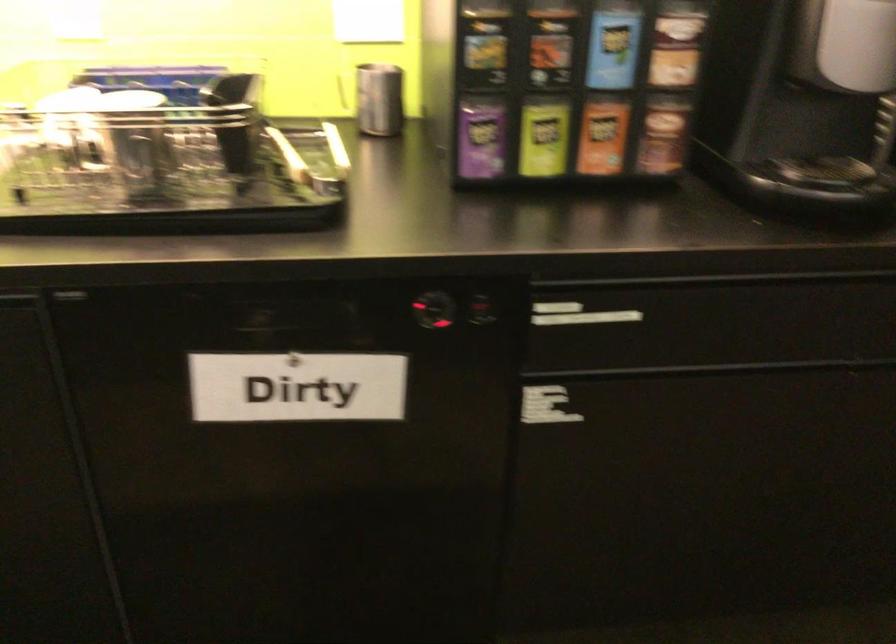
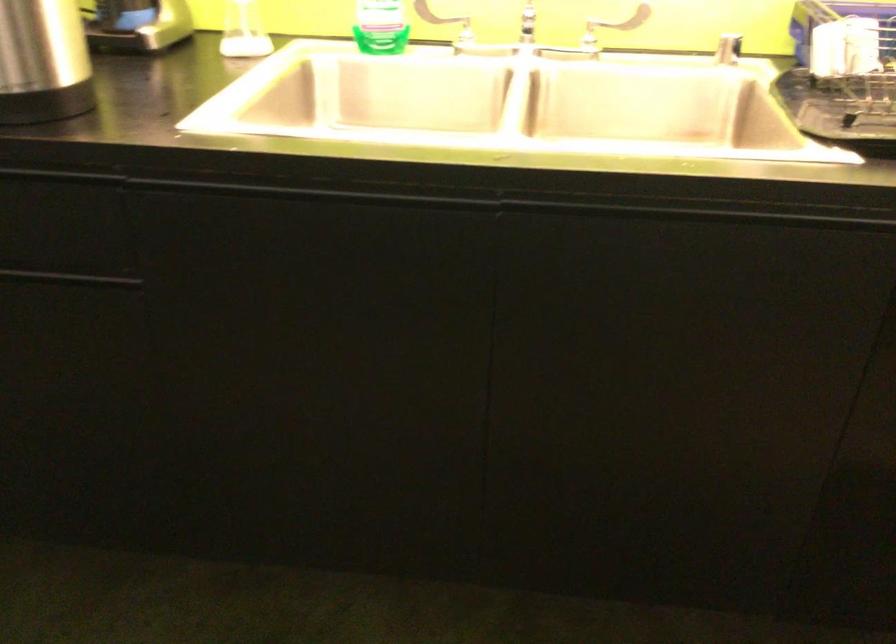
Question: What movement of the cameraman would produce the second image?

Choices:
 (A) Left
 (B) Right
 (C) Forward
 (D) Backward

Answer: (A)